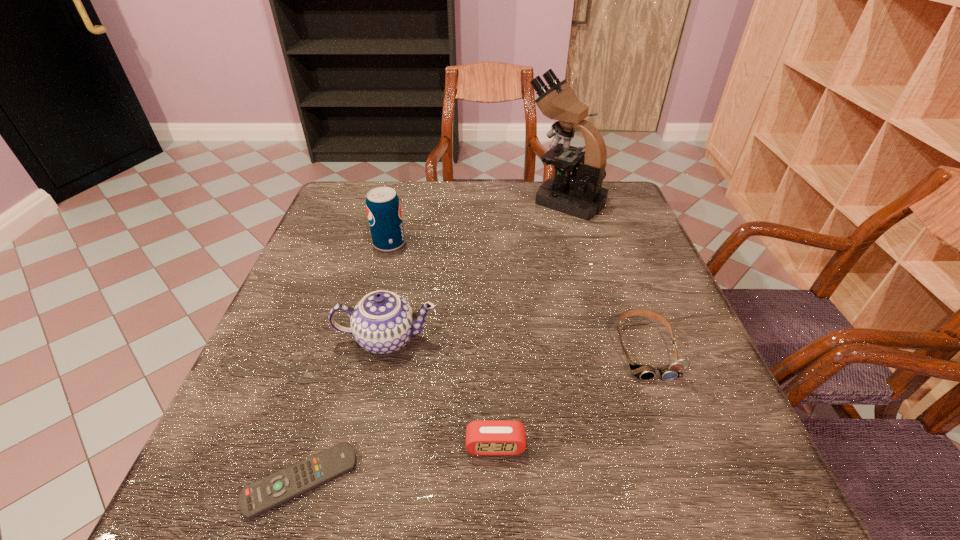
The height and width of the screenshot is (540, 960). In order to click on blank area located at the spout of the chinaware in this screenshot , I will do coord(368,430).

Locate an element on the screen. blank area located on the front-facing side of the goggles is located at coordinates (681, 448).

Where is `blank space located 0.090m on the front-facing side of the fourth object from left to right`? Image resolution: width=960 pixels, height=540 pixels. blank space located 0.090m on the front-facing side of the fourth object from left to right is located at coordinates (497, 516).

Where is `vacant space located 0.280m on the back of the shortest object`? This screenshot has height=540, width=960. vacant space located 0.280m on the back of the shortest object is located at coordinates (349, 320).

Locate an element on the screen. Image resolution: width=960 pixels, height=540 pixels. object that is at the far edge is located at coordinates (580, 194).

At what (x,y) coordinates should I click in order to perform the action: click on object that is at the near edge. Please return your answer as a coordinate pair (x, y). Image resolution: width=960 pixels, height=540 pixels. Looking at the image, I should click on (256, 498).

What are the coordinates of `chinaware that is at the left edge` in the screenshot? It's located at click(383, 322).

Locate an element on the screen. remote control present at the left edge is located at coordinates (256, 498).

Image resolution: width=960 pixels, height=540 pixels. Find the location of `microscope positioned at the right edge`. microscope positioned at the right edge is located at coordinates pos(580,194).

The image size is (960, 540). In order to click on goggles at the right edge in this screenshot , I will do `click(643, 372)`.